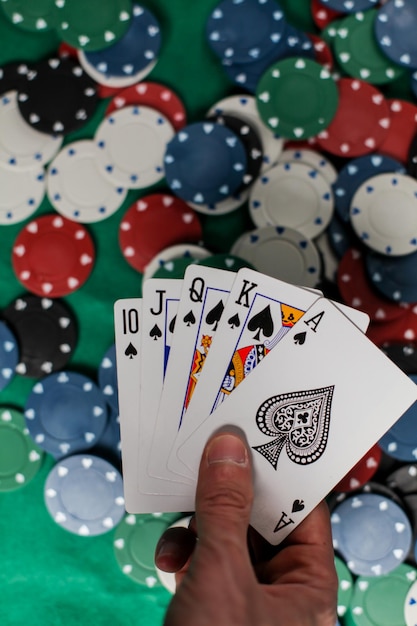
Where is `green cloth on a card table`? green cloth on a card table is located at coordinates (36, 515), (17, 389), (6, 275), (115, 283), (219, 226), (88, 130), (187, 68), (23, 42), (296, 7).